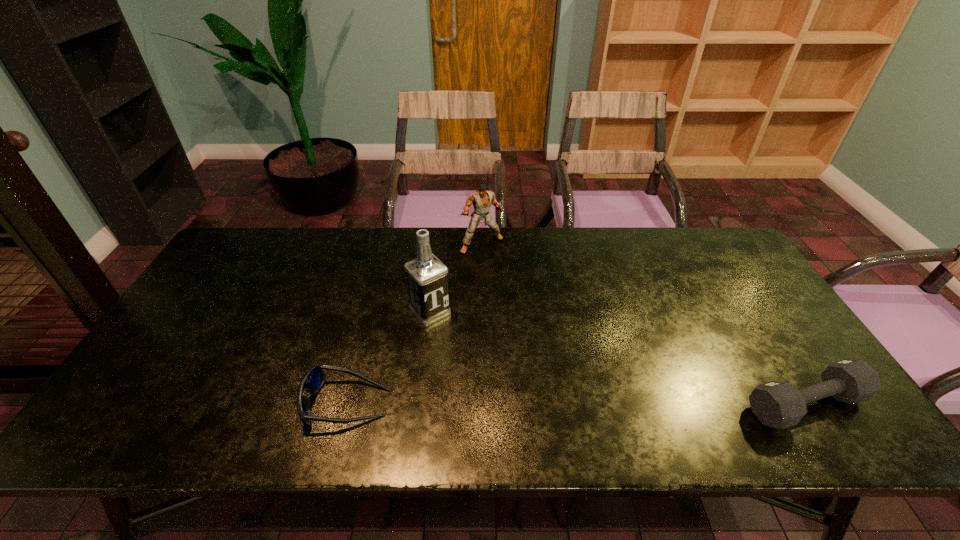
This screenshot has height=540, width=960. Identify the location of the third closest object to the vodka. (780, 405).

Locate an element on the screen. Image resolution: width=960 pixels, height=540 pixels. free spot that satisfies the following two spatial constraints: 1. on the front side of the second shortest object; 2. on the left side of the second object from left to right is located at coordinates (420, 404).